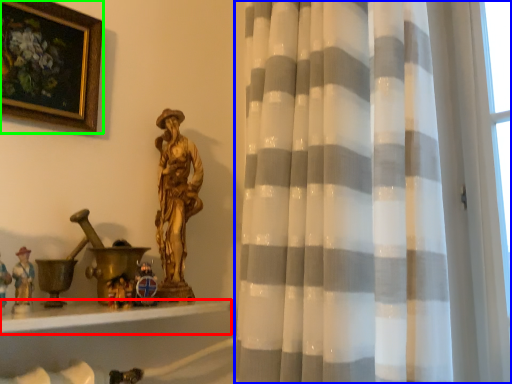
Question: Which is farther away from window sill (highlighted by a red box)? curtain (highlighted by a blue box) or picture frame (highlighted by a green box)?

Choices:
 (A) curtain
 (B) picture frame

Answer: (B)